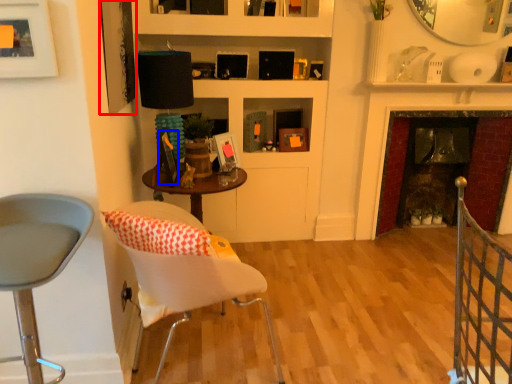
Question: Which object appears closest to the camera in this image, picture frame (highlighted by a red box) or picture frame (highlighted by a blue box)?

Choices:
 (A) picture frame
 (B) picture frame

Answer: (A)